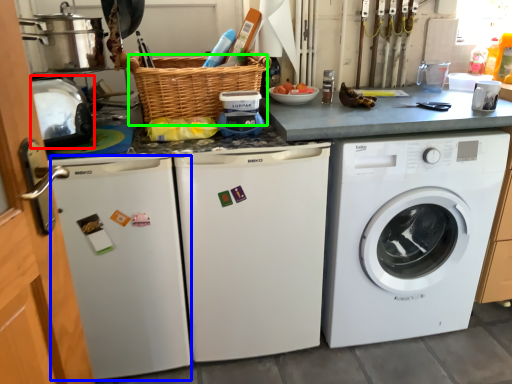
Question: Considering the real-world distances, which object is farthest from appliance (highlighted by a red box)? dish washer (highlighted by a blue box) or basket (highlighted by a green box)?

Choices:
 (A) dish washer
 (B) basket

Answer: (A)